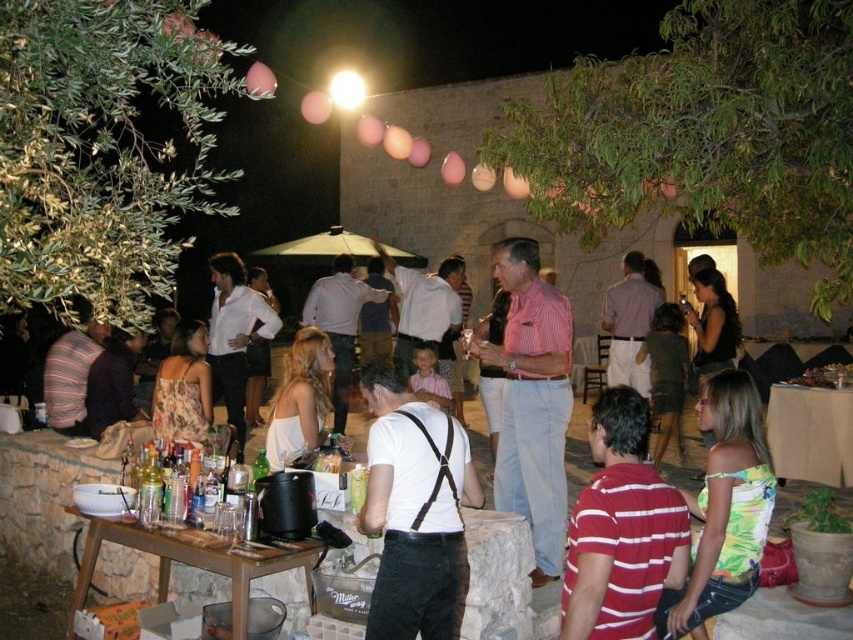
Which is behind, point (755, 401) or point (306, 422)?

Point (306, 422)

Which is in front, point (708, 465) or point (316, 397)?

Positioned in front is point (708, 465).

Identify the location of green floral tank top at lower right. (724, 508).

Is point (442, 416) more distant than point (809, 388)?

No, (442, 416) is closer to viewer.

Can you confirm if white matte suspenders at center is taller than white cardboard table at center?

Correct, white matte suspenders at center is much taller as white cardboard table at center.

Who is more forward, (387, 564) or (801, 440)?

Positioned in front is point (387, 564).

Where is `white matte suspenders at center`? The height and width of the screenshot is (640, 853). white matte suspenders at center is located at coordinates (415, 512).

In the scene shown: Is white matte suspenders at center wider than brown wooden table at lower left?

Incorrect, white matte suspenders at center's width does not surpass brown wooden table at lower left's.

Does white matte suspenders at center appear over brown wooden table at lower left?

Correct, white matte suspenders at center is located above brown wooden table at lower left.

Find the location of a particular element. The height and width of the screenshot is (640, 853). white matte suspenders at center is located at coordinates (415, 512).

This screenshot has height=640, width=853. I want to click on white matte suspenders at center, so click(415, 512).